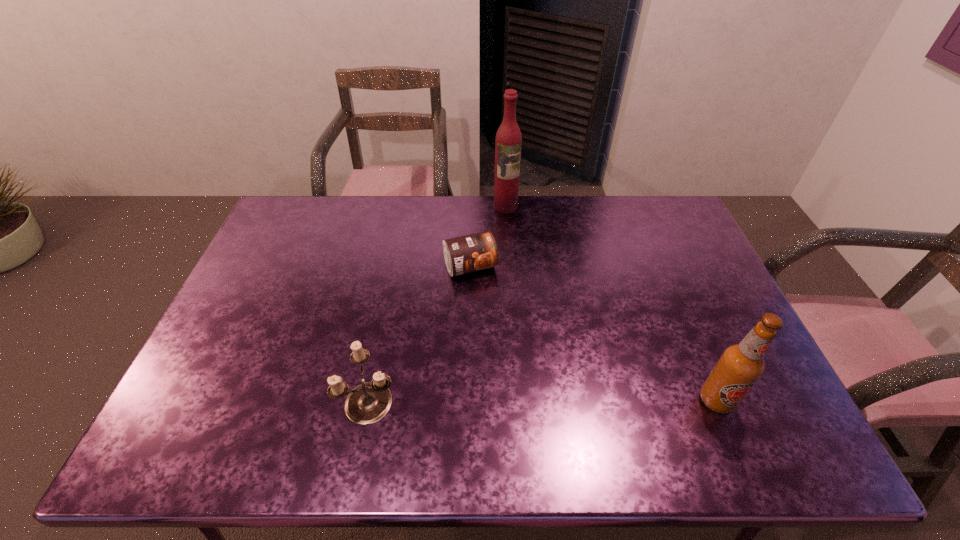
The image size is (960, 540). In order to click on vacant space on the desktop that is between the leftmost object and the rightmost object and is positioned on the label of the farthest object in this screenshot , I will do `click(585, 400)`.

Image resolution: width=960 pixels, height=540 pixels. In order to click on vacant space on the desktop that is between the leftmost object and the third shortest object and is positioned on the front label of the third nearest object in this screenshot , I will do `click(533, 400)`.